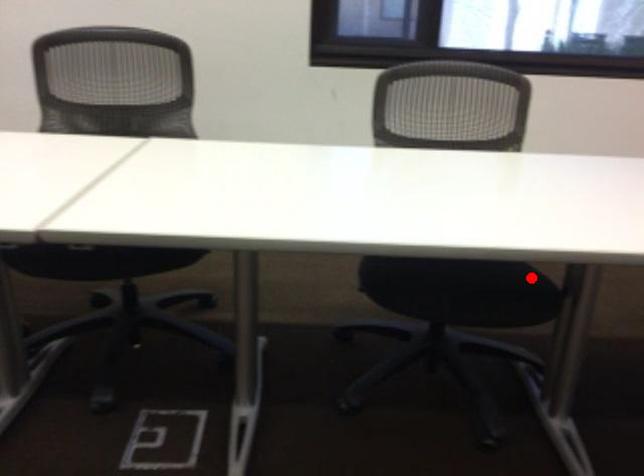
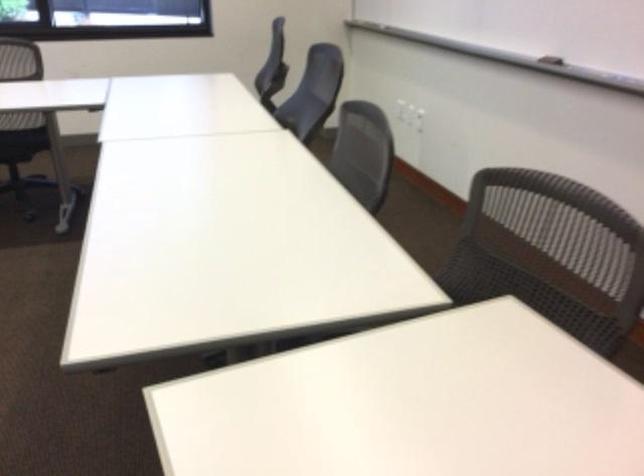
Question: I am providing you with two images of the same scene from different viewpoints. A red point is shown in image1. For the corresponding object point in image2, is it positioned nearer or farther from the camera?

Choices:
 (A) Nearer
 (B) Farther

Answer: (B)